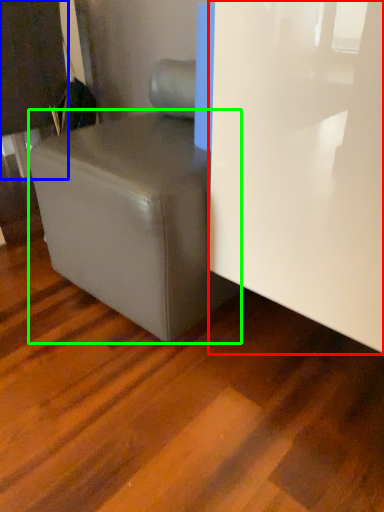
Question: Estimate the real-world distances between objects in this image. Which object is farther from glass door (highlighted by a red box), furniture (highlighted by a blue box) or table (highlighted by a green box)?

Choices:
 (A) furniture
 (B) table

Answer: (A)